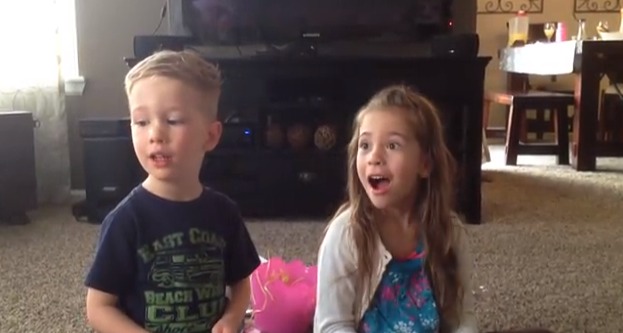
Image resolution: width=623 pixels, height=333 pixels. Identify the location of tv. (326, 10).